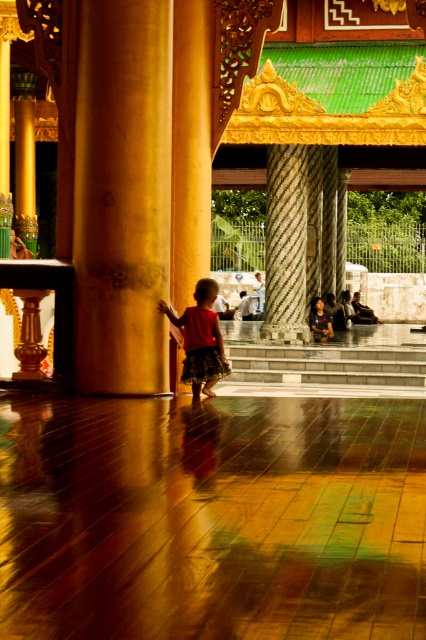
Question: Does gold polished pillar at center appear under marble-patterned column at center?

Choices:
 (A) yes
 (B) no

Answer: (A)

Question: Which of the following is the farthest from the observer?

Choices:
 (A) (124, 342)
 (B) (299, 314)
 (C) (219, 349)
 (D) (207, 332)

Answer: (B)

Question: Estimate the real-world distances between objects in this image. Which object is farther from the marble-patterned column at center?

Choices:
 (A) gold polished pillar at center
 (B) matte red dress at center
 (C) red cotton skirt at center

Answer: (C)

Question: Does gold polished pillar at center have a greater width compared to marble-patterned column at center?

Choices:
 (A) yes
 (B) no

Answer: (A)

Question: Does marble-patterned column at center have a smaller size compared to red cotton skirt at center?

Choices:
 (A) no
 (B) yes

Answer: (B)

Question: Which point is closer to the camera?

Choices:
 (A) gold polished pillar at center
 (B) matte red dress at center
 (C) red cotton skirt at center

Answer: (A)